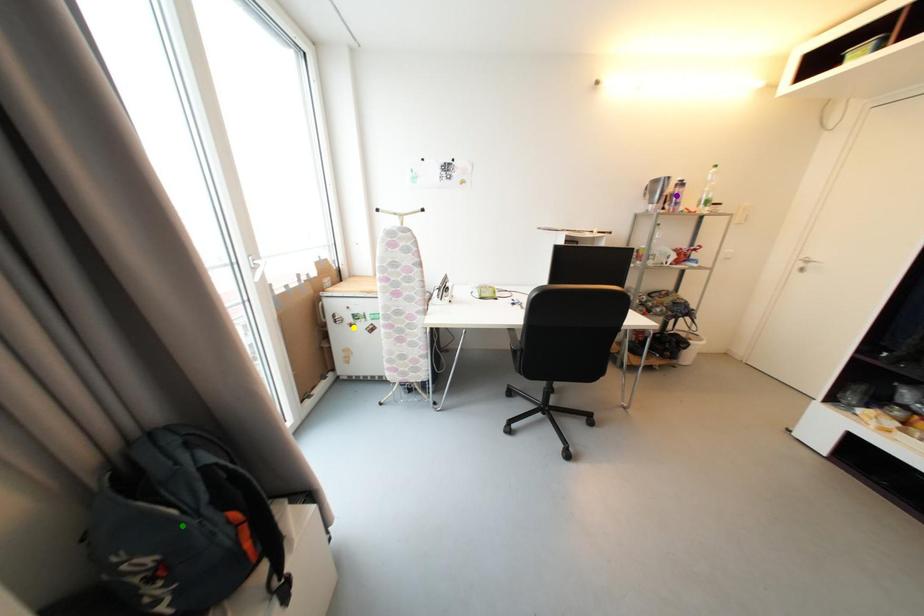
Order these from nearest to farthest:
green point
purple point
yellow point

1. purple point
2. yellow point
3. green point